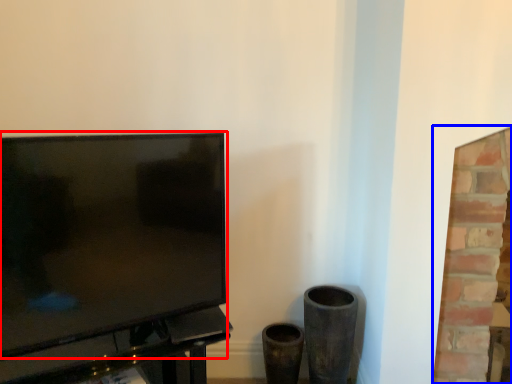
Question: Which object appears farthest to the camera in this image, television (highlighted by a red box) or fireplace (highlighted by a blue box)?

Choices:
 (A) television
 (B) fireplace

Answer: (B)